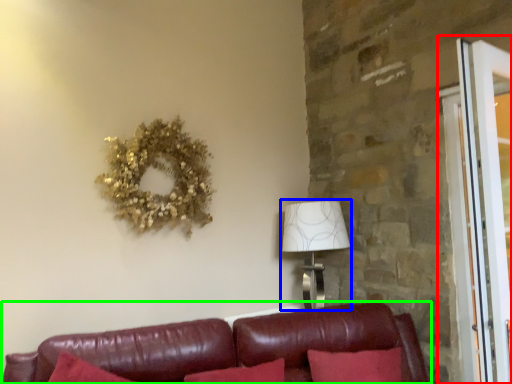
Question: Which object is positioned closest to screen door (highlighted by a red box)? Select from table lamp (highlighted by a blue box) and studio couch (highlighted by a green box).

Choices:
 (A) table lamp
 (B) studio couch

Answer: (B)